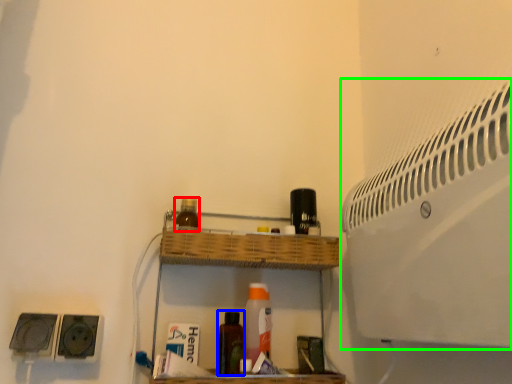
Question: Which object is positioned closest to bottle (highlighted by a red box)? Select from bottle (highlighted by a blue box) and air conditioning (highlighted by a green box).

Choices:
 (A) bottle
 (B) air conditioning

Answer: (A)